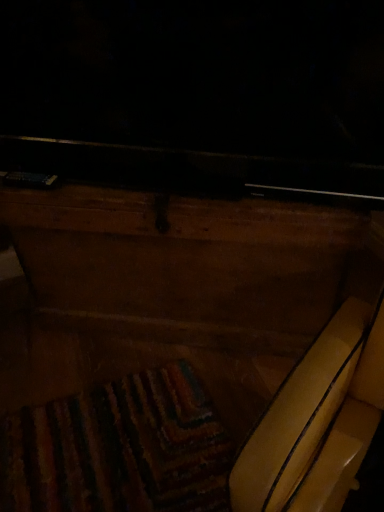
Question: Do you think yellow leather swivel chair at center is within wooden chest at center, or outside of it?

Choices:
 (A) outside
 (B) inside

Answer: (A)

Question: Is point (339, 312) positioned closer to the camera than point (11, 293)?

Choices:
 (A) farther
 (B) closer

Answer: (B)

Question: From the image's perspective, is yellow leather swivel chair at center located above or below wooden chest at center?

Choices:
 (A) below
 (B) above

Answer: (A)

Question: From a real-world perspective, relative to yellow leather swivel chair at center, is wooden chest at center vertically above or below?

Choices:
 (A) above
 (B) below

Answer: (B)

Question: Considering the positions of wooden chest at center and yellow leather swivel chair at center in the image, is wooden chest at center bigger or smaller than yellow leather swivel chair at center?

Choices:
 (A) big
 (B) small

Answer: (B)

Question: Considering the positions of wooden chest at center and yellow leather swivel chair at center in the image, is wooden chest at center taller or shorter than yellow leather swivel chair at center?

Choices:
 (A) tall
 (B) short

Answer: (B)

Question: From the image's perspective, is wooden chest at center located above or below yellow leather swivel chair at center?

Choices:
 (A) below
 (B) above

Answer: (B)